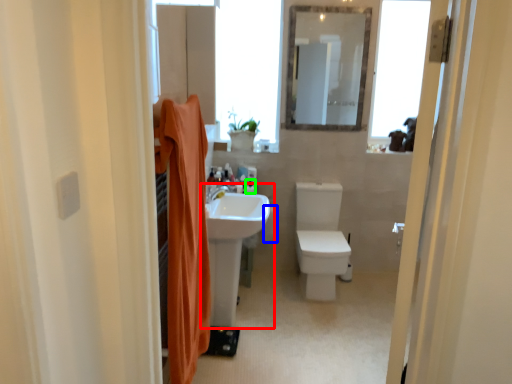
Question: Which is nearer to the sink (highlighted by a red box)? toilet paper (highlighted by a blue box) or toiletry (highlighted by a green box).

Choices:
 (A) toilet paper
 (B) toiletry

Answer: (B)